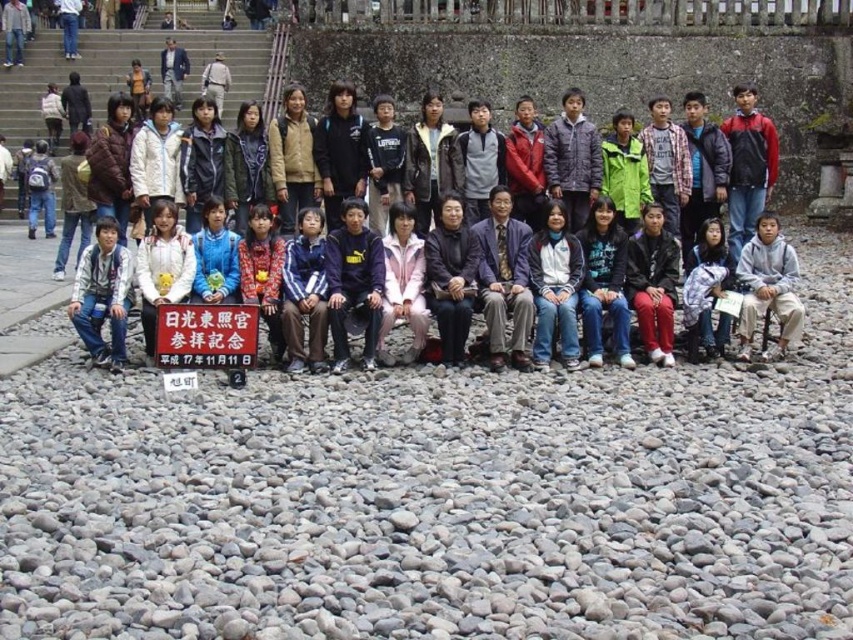
Question: Which point is farther to the camera?

Choices:
 (A) (741, 330)
 (B) (199, 316)
 (C) (730, 227)

Answer: (C)

Question: Which object is the farthest from the gray gravel at lower center?

Choices:
 (A) white paper sign at center
 (B) matte black sign at center
 (C) sweatshirt at center

Answer: (C)

Question: Can you confirm if gray gravel at lower center is positioned to the left of sweatshirt at center?

Choices:
 (A) no
 (B) yes

Answer: (B)

Question: Is gray gravel at lower center below white paper sign at center?

Choices:
 (A) no
 (B) yes

Answer: (B)

Question: Which of the following is the farthest from the observer?

Choices:
 (A) (755, 230)
 (B) (102, 582)
 (C) (154, 353)
 (D) (755, 227)

Answer: (D)

Question: Can you confirm if gray gravel at lower center is thinner than matte black sign at center?

Choices:
 (A) no
 (B) yes

Answer: (B)